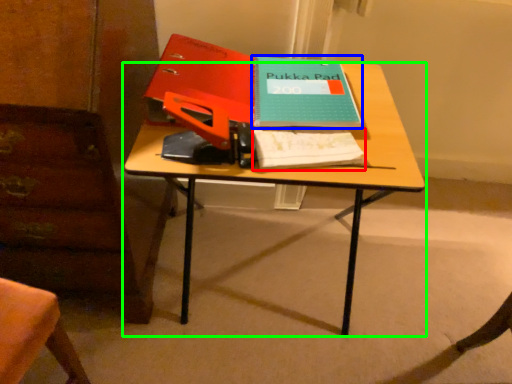
Question: Which object is positioned closest to notebook (highlighted by a red box)? Select from paperback book (highlighted by a blue box) and desk (highlighted by a green box).

Choices:
 (A) paperback book
 (B) desk

Answer: (B)